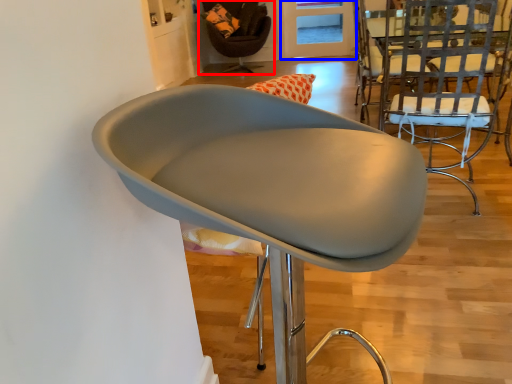
Question: Among these objects, which one is nearest to the camera, chair (highlighted by a red box) or glass door (highlighted by a blue box)?

Choices:
 (A) chair
 (B) glass door

Answer: (A)